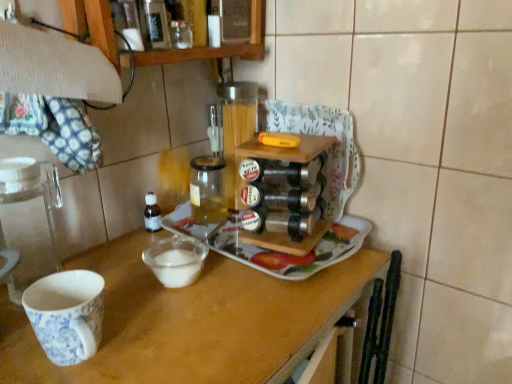
Question: Is translucent glass jar at center in front of or behind wooden table at center in the image?

Choices:
 (A) front
 (B) behind

Answer: (B)

Question: Considering the positions of point (210, 160) and point (139, 357), is point (210, 160) closer or farther from the camera than point (139, 357)?

Choices:
 (A) farther
 (B) closer

Answer: (A)

Question: Which object is positioned farthest from the white ceramic tray at center?

Choices:
 (A) wooden table at center
 (B) wooden shelf at upper left
 (C) translucent glass jar at center
 (D) porcelain cup at left

Answer: (B)

Question: Which object is positioned closest to the white ceramic tray at center?

Choices:
 (A) porcelain cup at left
 (B) translucent glass jar at center
 (C) wooden table at center
 (D) wooden shelf at upper left

Answer: (C)